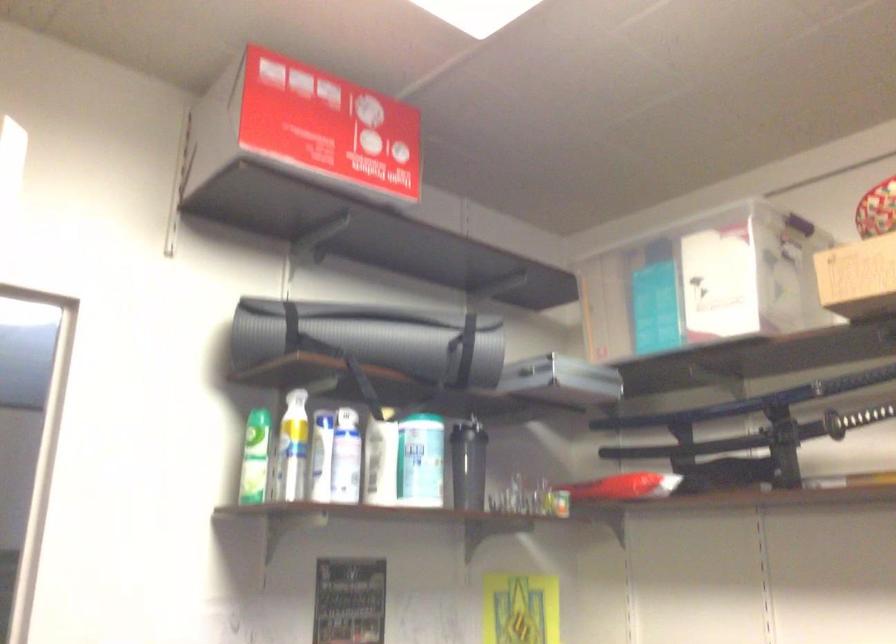
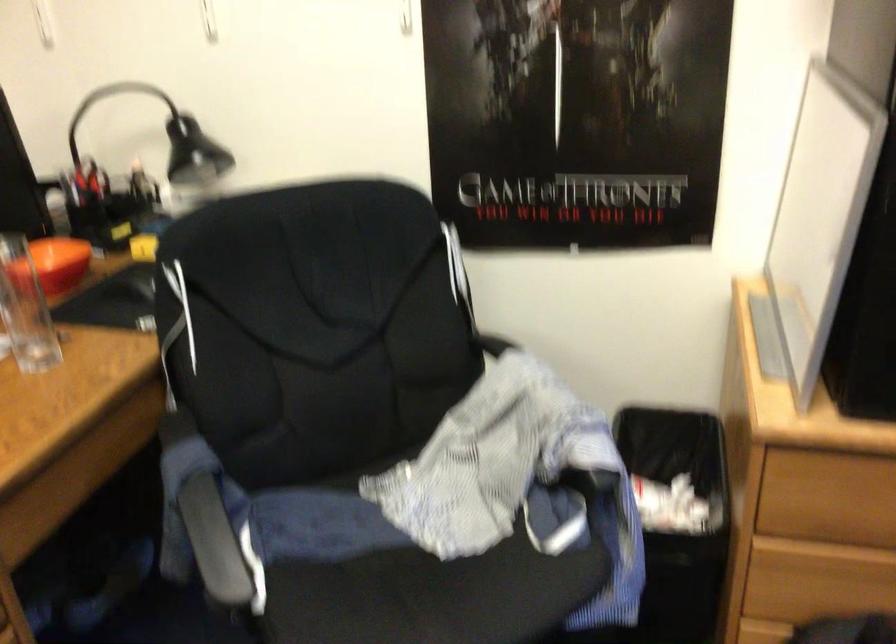
Based on the continuous images, in which direction is the camera rotating?

The camera's rotation is toward right-down.